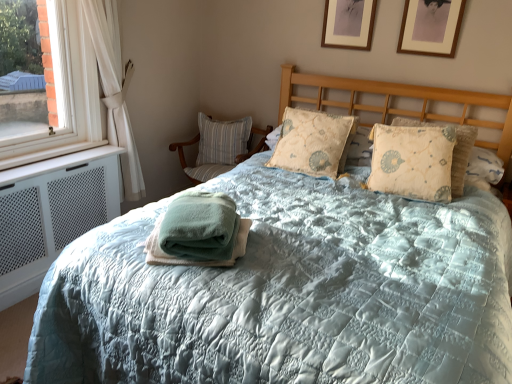
Question: From the image's perspective, does white sheer curtain at left appear lower than white mesh air conditioner at left?

Choices:
 (A) no
 (B) yes

Answer: (A)

Question: Is white sheer curtain at left far from white mesh air conditioner at left?

Choices:
 (A) no
 (B) yes

Answer: (A)

Question: Does white sheer curtain at left touch white mesh air conditioner at left?

Choices:
 (A) no
 (B) yes

Answer: (A)

Question: Does white sheer curtain at left have a larger size compared to white mesh air conditioner at left?

Choices:
 (A) yes
 (B) no

Answer: (A)

Question: Is white sheer curtain at left thinner than white mesh air conditioner at left?

Choices:
 (A) yes
 (B) no

Answer: (B)

Question: From the image's perspective, is wooden picture frame at upper right, the 2th picture frame from the left, positioned above or below striped fabric chair at left?

Choices:
 (A) below
 (B) above

Answer: (B)

Question: Looking at their shapes, would you say wooden picture frame at upper right, the 2th picture frame from the left, is wider or thinner than striped fabric chair at left?

Choices:
 (A) thin
 (B) wide

Answer: (A)

Question: Is wooden picture frame at upper right, the 2th picture frame from the left, situated inside striped fabric chair at left or outside?

Choices:
 (A) outside
 (B) inside

Answer: (A)

Question: Is point (411, 9) positioned closer to the camera than point (192, 180)?

Choices:
 (A) farther
 (B) closer

Answer: (B)

Question: In terms of width, does wooden picture frame at upper right, the second picture frame from the right, look wider or thinner when compared to striped fabric pillow at left, the third pillow when ordered from front to back?

Choices:
 (A) thin
 (B) wide

Answer: (A)

Question: In the image, is wooden picture frame at upper right, which is the first picture frame in left-to-right order, on the left side or the right side of striped fabric pillow at left, arranged as the 1th pillow when viewed from the left?

Choices:
 (A) left
 (B) right

Answer: (B)

Question: From the image's perspective, is wooden picture frame at upper right, which is the first picture frame in left-to-right order, positioned above or below striped fabric pillow at left, arranged as the 1th pillow when viewed from the left?

Choices:
 (A) below
 (B) above

Answer: (B)

Question: From their relative heights in the image, would you say wooden picture frame at upper right, which is the first picture frame in left-to-right order, is taller or shorter than striped fabric pillow at left, the 1th pillow viewed from the back?

Choices:
 (A) tall
 (B) short

Answer: (B)

Question: Choose the correct answer: Is green cotton towel at center inside striped fabric pillow at left, the 1th pillow viewed from the back, or outside it?

Choices:
 (A) outside
 (B) inside

Answer: (A)

Question: In terms of size, does green cotton towel at center appear bigger or smaller than striped fabric pillow at left, the 1th pillow viewed from the back?

Choices:
 (A) big
 (B) small

Answer: (B)